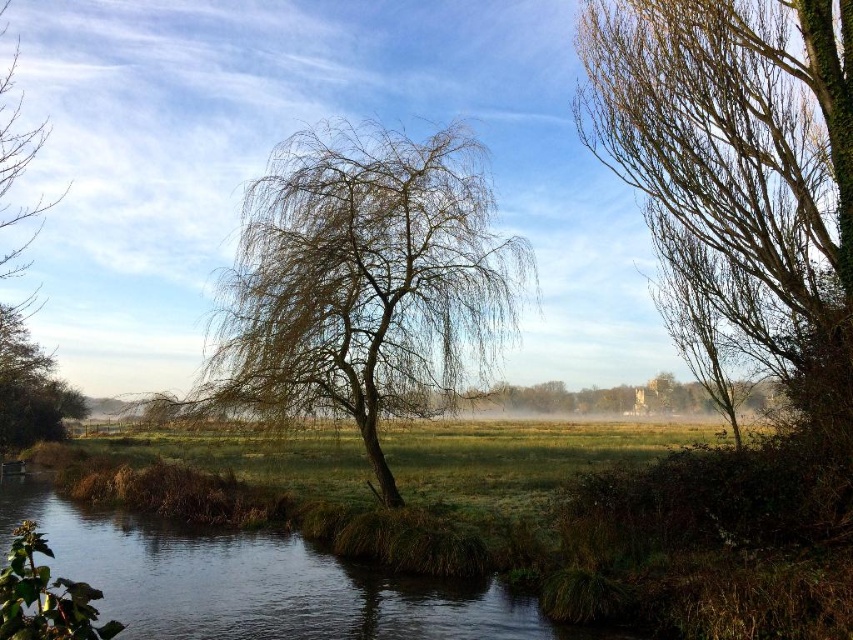
Question: Does foggy mist at center have a greater width compared to brown leafy tree at upper left?

Choices:
 (A) yes
 (B) no

Answer: (A)

Question: Which object appears farthest from the camera in this image?

Choices:
 (A) foggy mist at center
 (B) brown leafy tree at upper left

Answer: (A)

Question: Which of the following is the farthest from the observer?

Choices:
 (A) (55, 387)
 (B) (90, 24)
 (C) (355, 598)

Answer: (A)

Question: Is green grassy river at lower left further to the viewer compared to brown leafy tree at upper left?

Choices:
 (A) no
 (B) yes

Answer: (A)

Question: Does brown textured tree at center come behind green grassy river at lower left?

Choices:
 (A) yes
 (B) no

Answer: (A)

Question: Estimate the real-world distances between objects in this image. Which object is farther from the brown textured tree at center?

Choices:
 (A) green grassy river at lower left
 (B) brown leafy tree at upper left

Answer: (B)